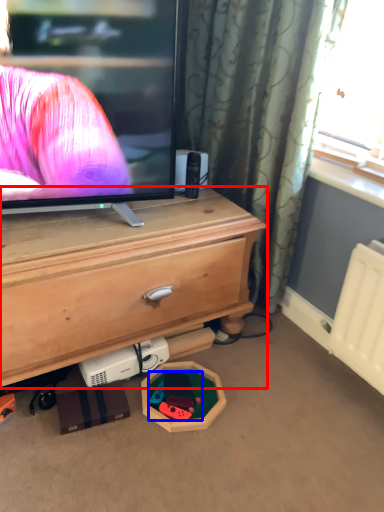
Question: Which of the following is the farthest to the observer, chest of drawers (highlighted by a red box) or toy (highlighted by a blue box)?

Choices:
 (A) chest of drawers
 (B) toy

Answer: (B)